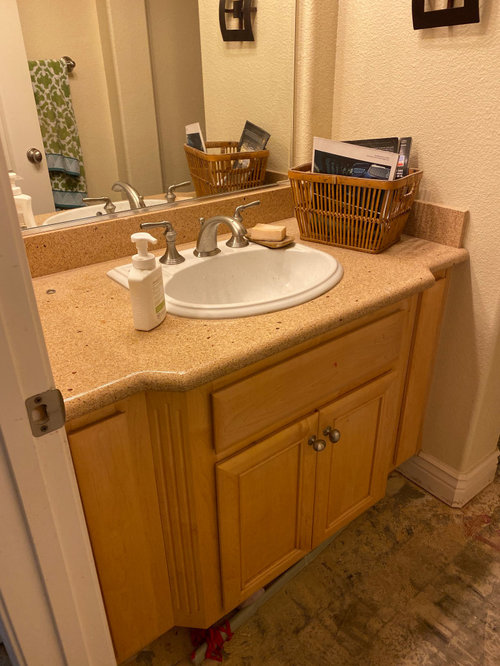
Find the location of a particular element. This screenshot has width=500, height=666. small basket is located at coordinates (390, 184).